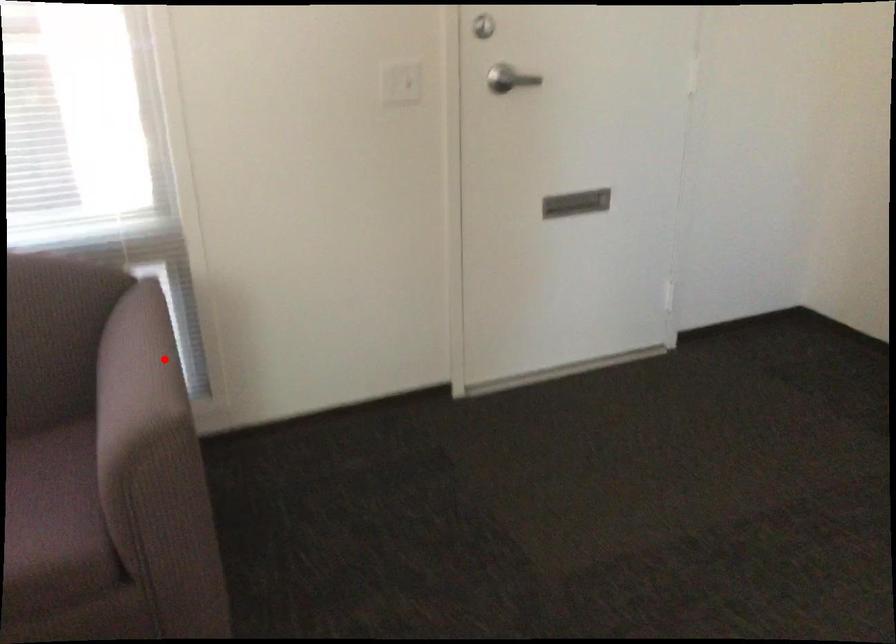
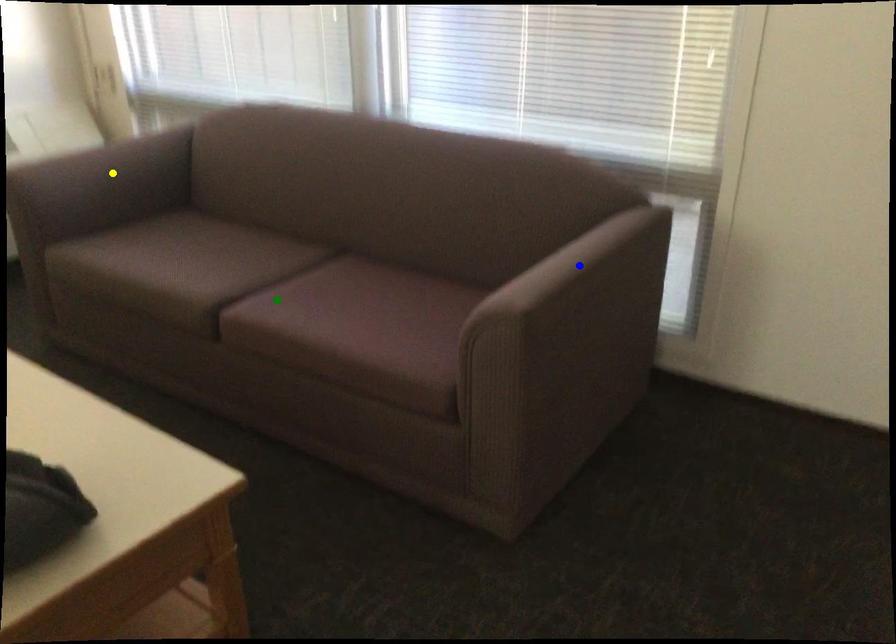
Question: I am providing you with two images of the same scene from different viewpoints. A red point is marked on the first image. You are given multiple points on the second image. Which spot in image 2 lines up with the point in image 1?

Choices:
 (A) green point
 (B) yellow point
 (C) blue point

Answer: (C)